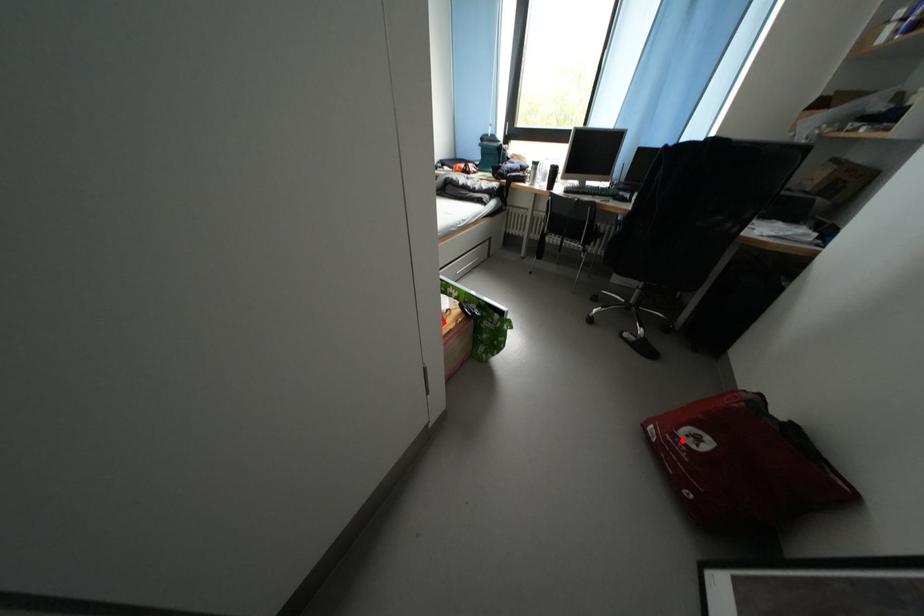
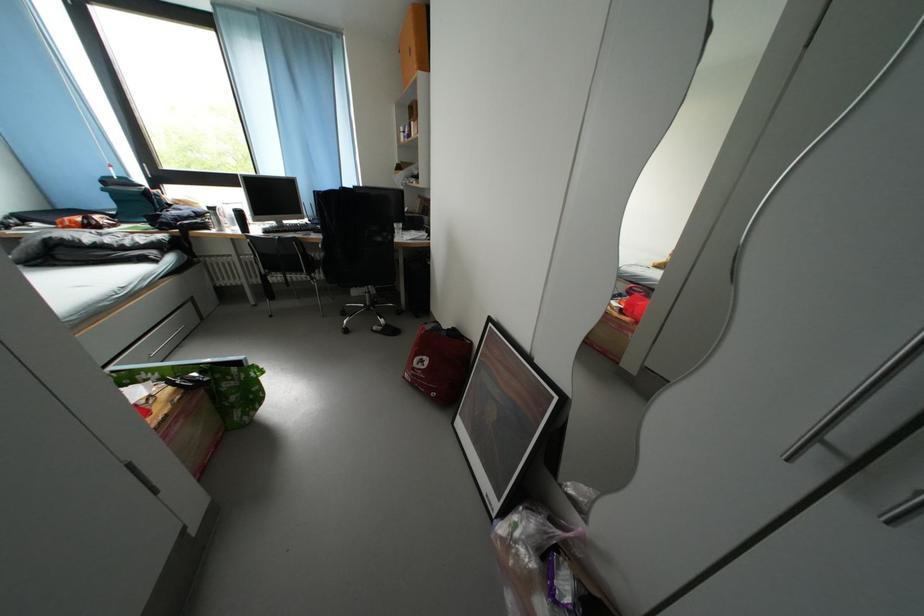
Question: I am providing you with two images of the same scene from different viewpoints. Given a red point in image1, look at the same physical point in image2. Is it:

Choices:
 (A) Closer to the viewpoint
 (B) Farther from the viewpoint

Answer: (B)